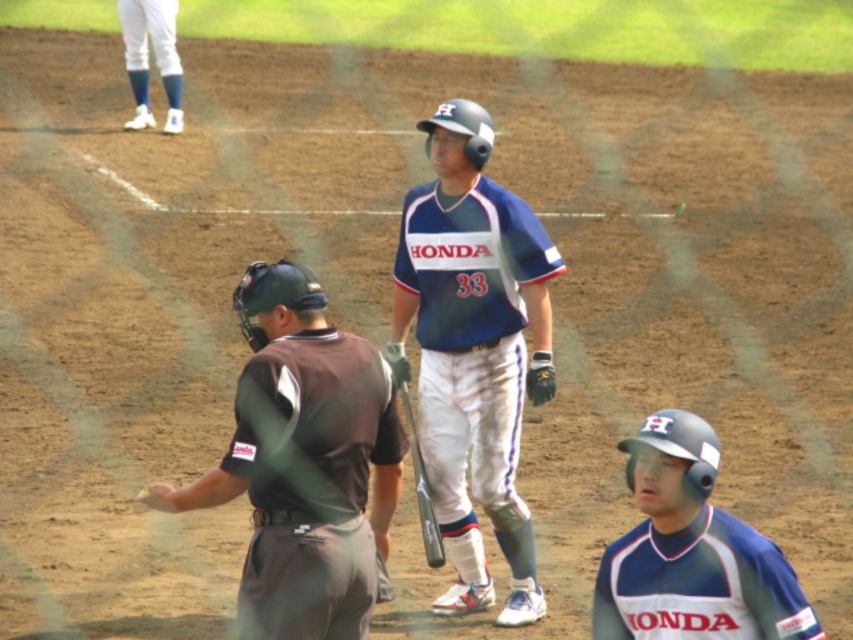
Question: Estimate the real-world distances between objects in this image. Which object is closer to the black leather glove at center?

Choices:
 (A) dark green uniform at center
 (B) silver metallic bat at center
 (C) blue fabric baseball uniform at center
 (D) blue/white socks at upper left

Answer: (C)

Question: Does dark green uniform at center appear on the left side of dark gray leather glove at center?

Choices:
 (A) yes
 (B) no

Answer: (A)

Question: Based on their relative distances, which object is nearer to the dark green uniform at center?

Choices:
 (A) blue fabric baseball uniform at center
 (B) dark gray leather glove at center
 (C) blue/white socks at upper left
 (D) silver metallic bat at center

Answer: (D)

Question: Is dark green uniform at center below dark gray leather glove at center?

Choices:
 (A) no
 (B) yes

Answer: (B)

Question: Where is dark green uniform at center located in relation to blue/white socks at upper left in the image?

Choices:
 (A) below
 (B) above

Answer: (A)

Question: Estimate the real-world distances between objects in this image. Which object is farther from the black leather glove at center?

Choices:
 (A) matte blue baseball uniform at center
 (B) dark gray leather glove at center
 (C) blue fabric baseball uniform at center
 (D) blue/white socks at upper left

Answer: (D)